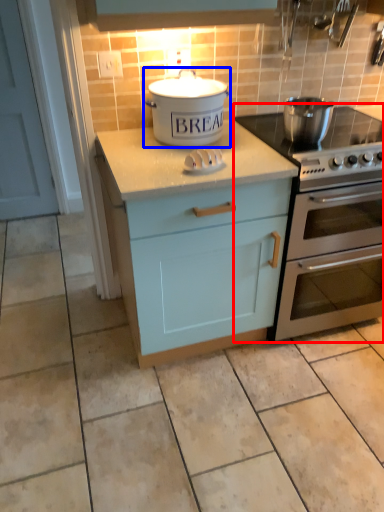
Question: Which object is further to the camera taking this photo, oven (highlighted by a red box) or kitchen appliance (highlighted by a blue box)?

Choices:
 (A) oven
 (B) kitchen appliance

Answer: (A)